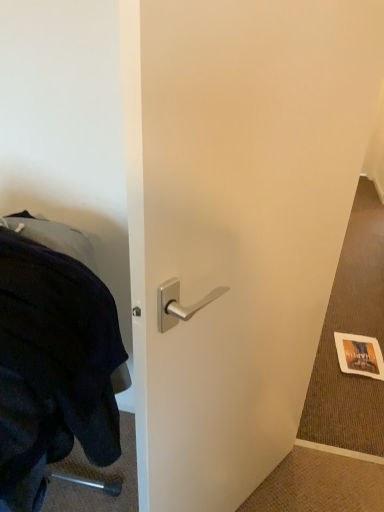
Question: Is gold textured paper at lower right closer to the viewer compared to satin silver handle at center?

Choices:
 (A) no
 (B) yes

Answer: (A)

Question: From the image's perspective, is gold textured paper at lower right over satin silver handle at center?

Choices:
 (A) no
 (B) yes

Answer: (A)

Question: Does gold textured paper at lower right have a larger size compared to satin silver handle at center?

Choices:
 (A) yes
 (B) no

Answer: (B)

Question: Is gold textured paper at lower right wider than satin silver handle at center?

Choices:
 (A) yes
 (B) no

Answer: (A)

Question: Is gold textured paper at lower right to the right of satin silver handle at center from the viewer's perspective?

Choices:
 (A) no
 (B) yes

Answer: (B)

Question: From a real-world perspective, is black fabric at left above or below gold textured paper at lower right?

Choices:
 (A) above
 (B) below

Answer: (A)

Question: Visually, is black fabric at left positioned to the left or to the right of gold textured paper at lower right?

Choices:
 (A) left
 (B) right

Answer: (A)

Question: In terms of size, does black fabric at left appear bigger or smaller than gold textured paper at lower right?

Choices:
 (A) big
 (B) small

Answer: (A)

Question: Considering the positions of point (102, 396) and point (380, 353), is point (102, 396) closer or farther from the camera than point (380, 353)?

Choices:
 (A) closer
 (B) farther

Answer: (A)

Question: Would you say satin silver handle at center is inside or outside gold textured paper at lower right?

Choices:
 (A) outside
 (B) inside

Answer: (A)

Question: Is point 236,3 closer or farther from the camera than point 367,372?

Choices:
 (A) farther
 (B) closer

Answer: (B)

Question: In terms of size, does satin silver handle at center appear bigger or smaller than gold textured paper at lower right?

Choices:
 (A) small
 (B) big

Answer: (B)

Question: Considering the positions of satin silver handle at center and gold textured paper at lower right in the image, is satin silver handle at center taller or shorter than gold textured paper at lower right?

Choices:
 (A) short
 (B) tall

Answer: (B)

Question: Considering the positions of gold textured paper at lower right and satin silver handle at center in the image, is gold textured paper at lower right wider or thinner than satin silver handle at center?

Choices:
 (A) wide
 (B) thin

Answer: (A)

Question: Is gold textured paper at lower right spatially inside satin silver handle at center, or outside of it?

Choices:
 (A) inside
 (B) outside

Answer: (B)